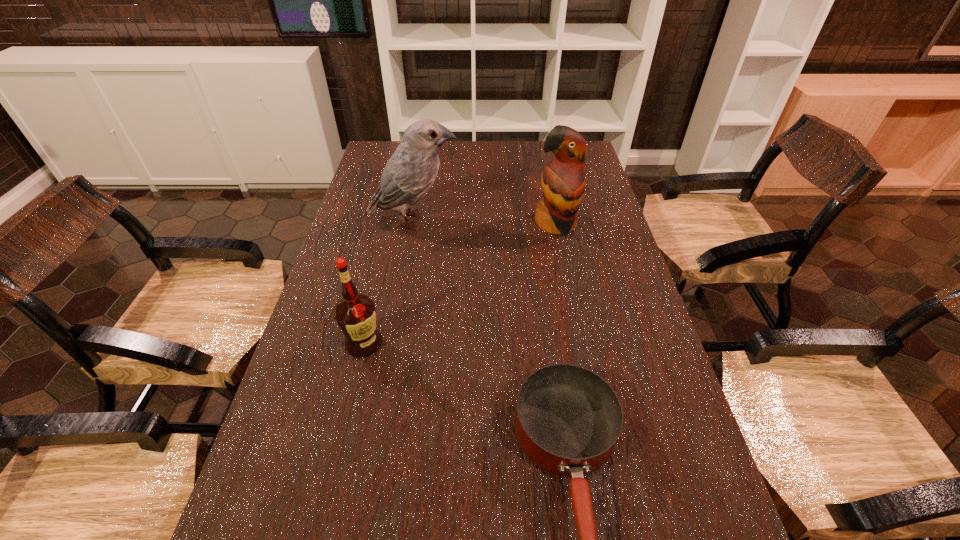
At what (x,y) coordinates should I click in order to perform the action: click on object that stands as the third closest to the pan. Please return your answer as a coordinate pair (x, y). Looking at the image, I should click on (408, 175).

Find the location of a particular element. The image size is (960, 540). vacant area that satisfies the following two spatial constraints: 1. on the front-facing side of the left parrot; 2. on the label of the third farthest object is located at coordinates (393, 343).